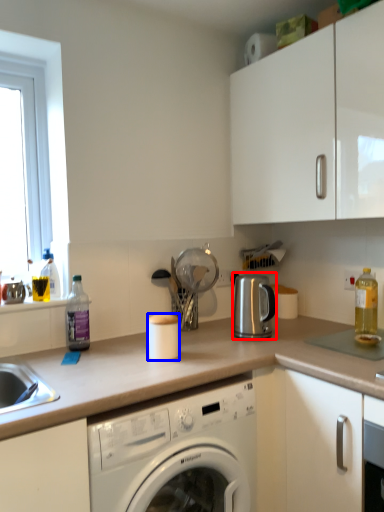
Question: Which of the following is the closest to the observer, appliance (highlighted by a red box) or appliance (highlighted by a blue box)?

Choices:
 (A) appliance
 (B) appliance

Answer: (B)